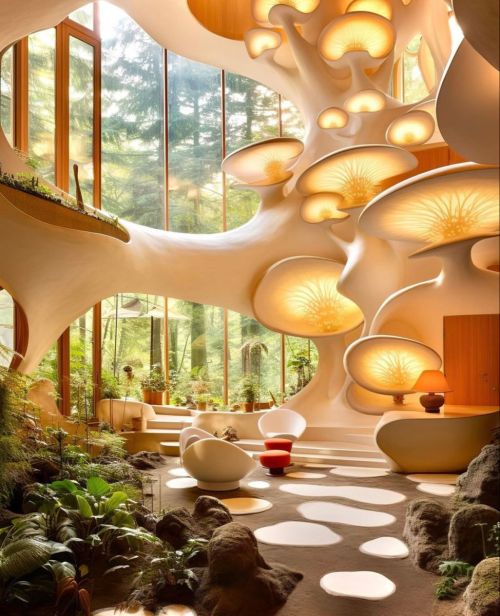
This screenshot has width=500, height=616. Identify the location of lamp. (430, 405).